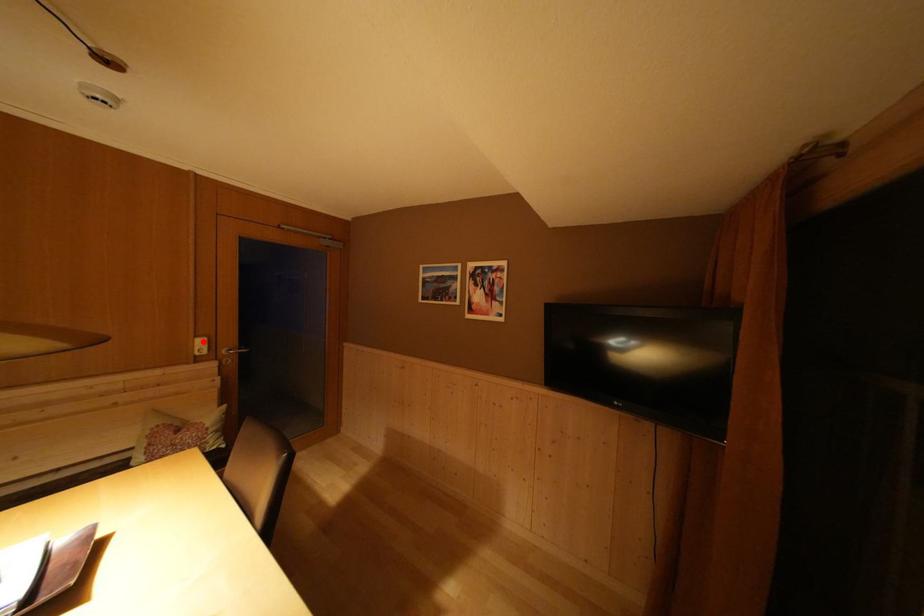
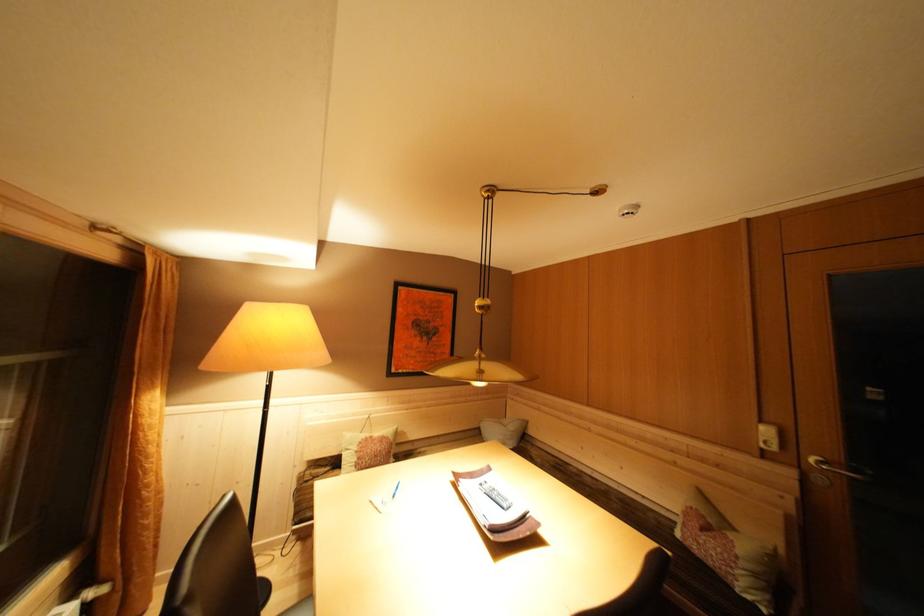
Find the pixel in the second image that matches the highlighted location in the first image.

(768, 427)